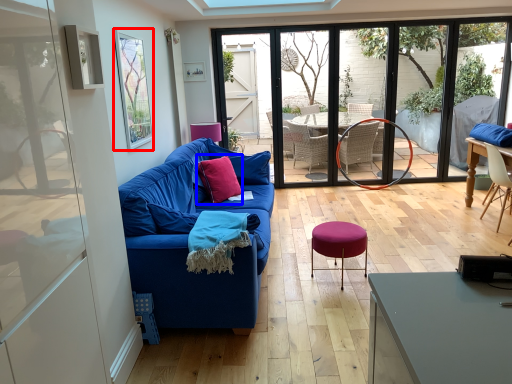
Question: Among these objects, which one is farthest to the camera, window screen (highlighted by a red box) or pillow (highlighted by a blue box)?

Choices:
 (A) window screen
 (B) pillow

Answer: (B)